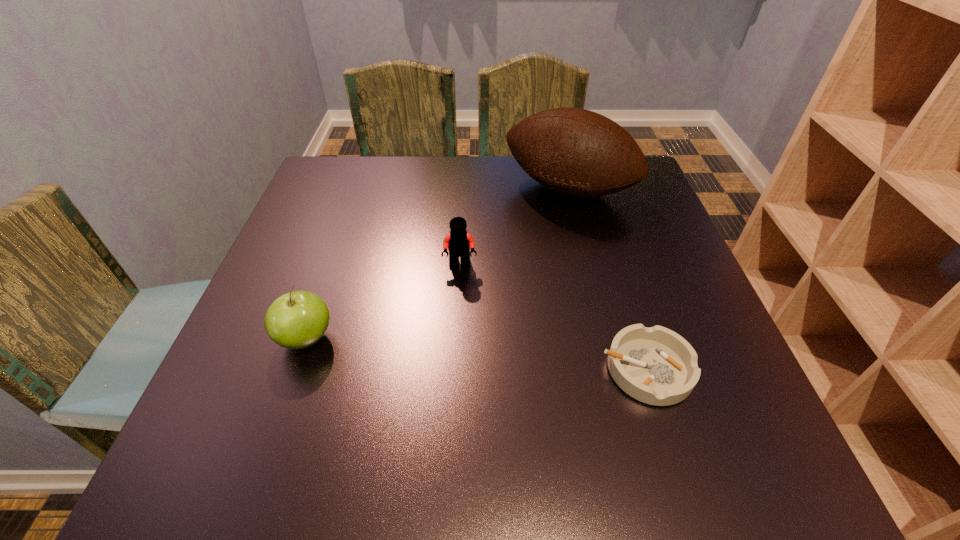
Locate an element on the screen. The height and width of the screenshot is (540, 960). object present at the near right corner is located at coordinates (657, 366).

Find the location of a particular element. This screenshot has height=540, width=960. free region at the far edge of the desktop is located at coordinates (461, 202).

I want to click on vacant area at the near edge of the desktop, so click(x=369, y=416).

In the image, there is a desktop. Where is `vacant area at the left edge`? The image size is (960, 540). vacant area at the left edge is located at coordinates (340, 288).

Find the location of a particular element. This screenshot has width=960, height=540. free point at the right edge is located at coordinates (651, 316).

You are a GUI agent. You are given a task and a screenshot of the screen. Output one action in this format:
    pyautogui.click(x=<x>, y=<y>)
    Task: Click on the vacant space at the far left corner of the desktop
    
    Given the screenshot: What is the action you would take?
    [321, 206]

What are the coordinates of `vacant region at the near left corner of the desktop` in the screenshot? It's located at (254, 379).

In the image, there is a desktop. Find the location of `vacant region at the far right corner`. vacant region at the far right corner is located at coordinates (622, 192).

Locate an element on the screen. This screenshot has height=540, width=960. empty space that is in between the leftmost object and the Lego is located at coordinates (383, 302).

Where is `vacant space that's between the leftmost object and the farthest object`? The width and height of the screenshot is (960, 540). vacant space that's between the leftmost object and the farthest object is located at coordinates (438, 264).